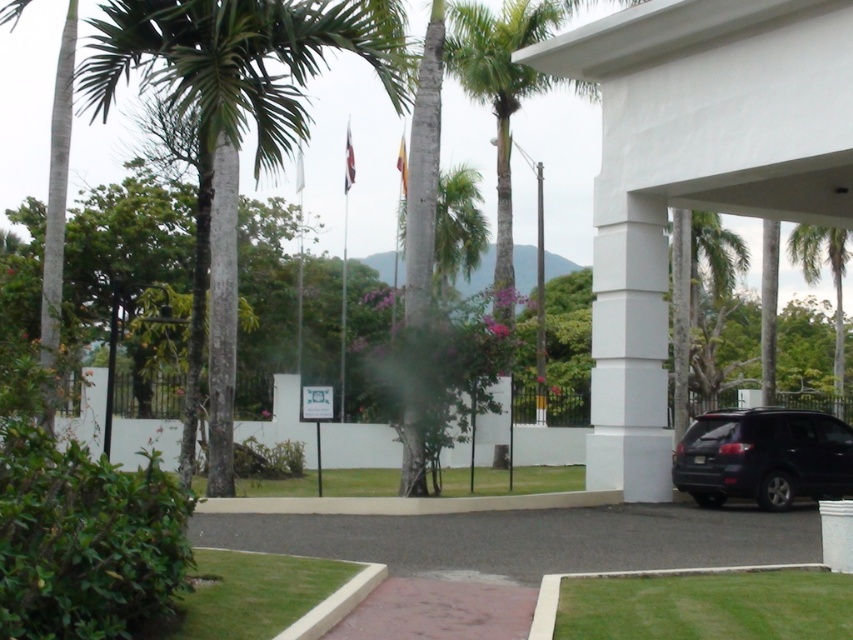
Question: Which point appears closest to the camera in this image?

Choices:
 (A) (338, 413)
 (B) (677, 321)

Answer: (B)

Question: Can you confirm if green leafy palm tree at center is wider than white plastic flag pole at center?

Choices:
 (A) yes
 (B) no

Answer: (A)

Question: Which of the following is the closest to the observer?

Choices:
 (A) (683, 323)
 (B) (831, 250)
 (C) (828, 435)

Answer: (C)

Question: Is dark gray asphalt at center wider than white plastic flag pole at center?

Choices:
 (A) no
 (B) yes

Answer: (B)

Question: Is green textured palm tree at center wider than green leafy palm tree at upper right?

Choices:
 (A) no
 (B) yes

Answer: (B)

Question: Based on their relative distances, which object is nearer to the green leafy palm tree at center?

Choices:
 (A) green leafy palm tree at upper right
 (B) green textured palm tree at center
 (C) dark gray asphalt at center

Answer: (A)